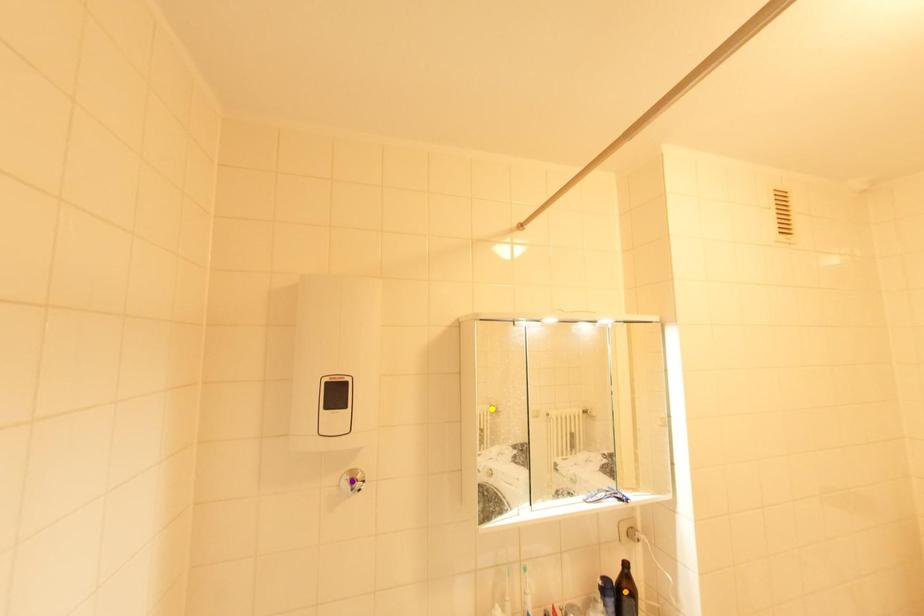
In the scene shown: Order these from farthest to nearest:
1. yellow point
2. purple point
3. orange point

yellow point < orange point < purple point